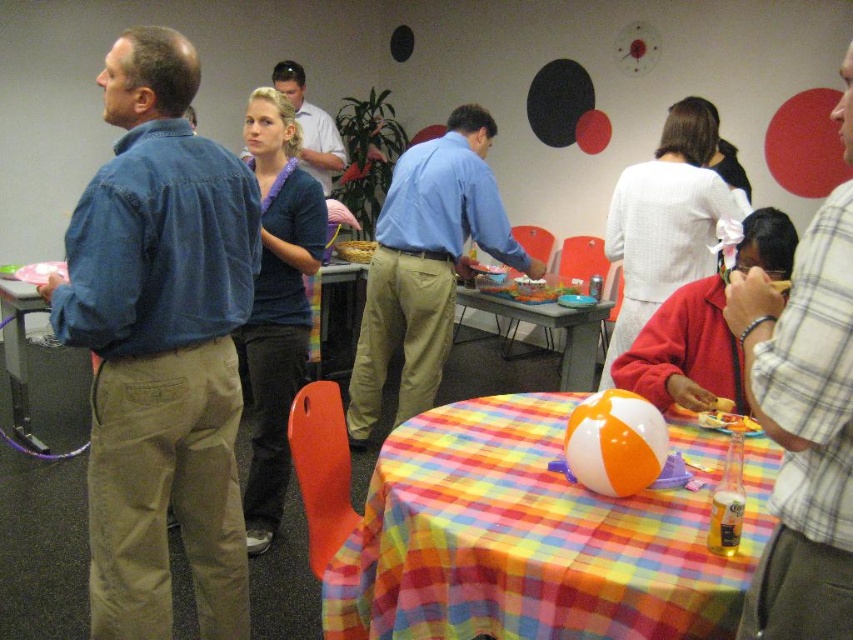
You are a guest at the party and want to take a photo with both the matte blue shirt at center and the matte brown cake at center. Which object should you place closer to the camera to ensure both are in focus?

The matte blue shirt at center is taller than the matte brown cake at center. To ensure both are in focus, place the matte blue shirt at center closer to the camera since it is taller, allowing the cake to be in the background within the depth of field.

You are organizing a closet and need to place the plaid shirt at right and the matte blue shirt at center. Given their widths, which shirt should you place on the narrower hanger?

The plaid shirt at right has a smaller width than the matte blue shirt at center, so it should be placed on the narrower hanger.